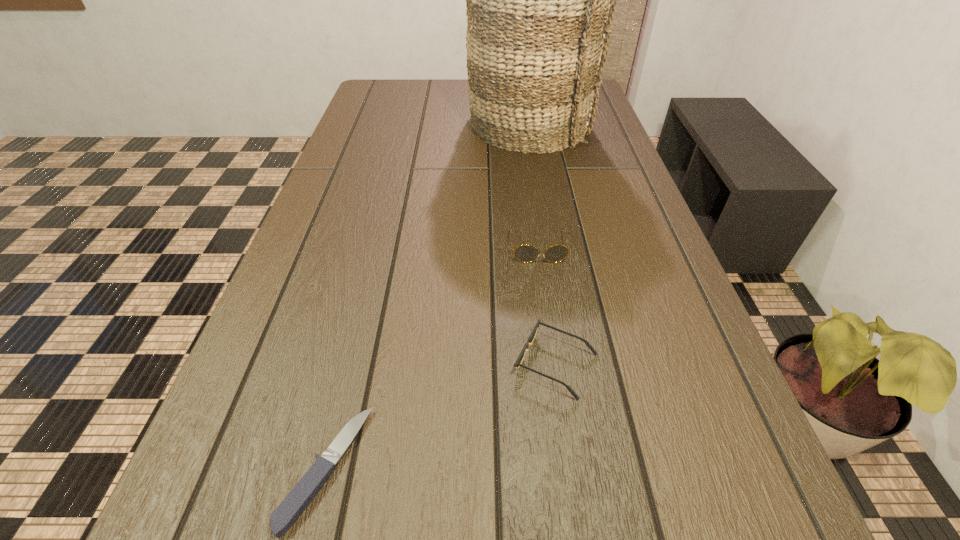
In the image, there is a desktop. Where is `blank space at the right edge`? Image resolution: width=960 pixels, height=540 pixels. blank space at the right edge is located at coordinates pos(625,264).

The image size is (960, 540). In the image, there is a desktop. Identify the location of free space at the far left corner. (366, 103).

Locate an element on the screen. This screenshot has height=540, width=960. free spot between the second farthest object and the nearest object is located at coordinates (432, 357).

I want to click on free space that is in between the taller sunglasses and the basket, so click(x=533, y=187).

I want to click on vacant region between the nearest object and the taller sunglasses, so click(432, 357).

Locate an element on the screen. This screenshot has width=960, height=540. vacant region between the third shortest object and the leftmost object is located at coordinates (432, 357).

What are the coordinates of `unoccupied position between the leftmost object and the basket` in the screenshot? It's located at (427, 297).

This screenshot has height=540, width=960. I want to click on free space that is in between the third nearest object and the third farthest object, so click(547, 306).

Find the location of `unoccupied area between the steak knife and the third nearest object`. unoccupied area between the steak knife and the third nearest object is located at coordinates (432, 357).

Where is `blank region between the tallest object and the second shortest object`? The height and width of the screenshot is (540, 960). blank region between the tallest object and the second shortest object is located at coordinates (541, 245).